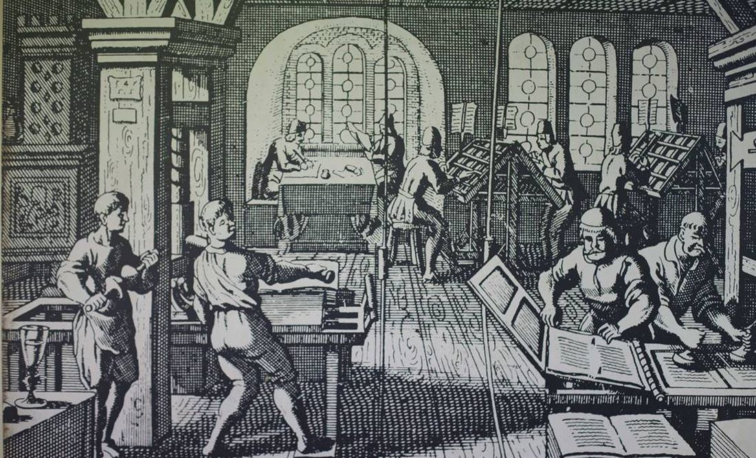
You are a GUI agent. You are given a task and a screenshot of the screen. Output one action in this format:
    pyautogui.click(x=<x>, y=<y>)
    Task: Click on the windows
    The width and height of the screenshot is (756, 458).
    Given the screenshot: What is the action you would take?
    pyautogui.click(x=342, y=98), pyautogui.click(x=603, y=97)